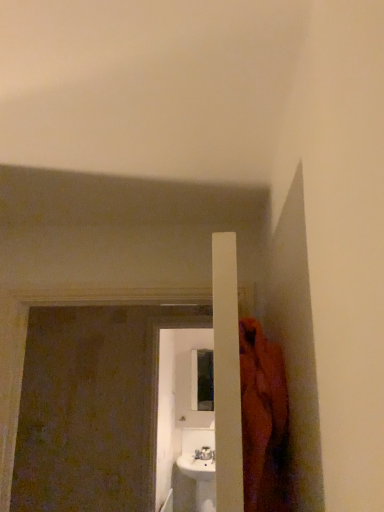
Question: Considering the relative positions of white glossy screen door at center, positioned as the first screen door in back-to-front order, and brown textured screen door at left, the first screen door when ordered from front to back, in the image provided, is white glossy screen door at center, positioned as the first screen door in back-to-front order, to the right of brown textured screen door at left, the first screen door when ordered from front to back, from the viewer's perspective?

Choices:
 (A) no
 (B) yes

Answer: (B)

Question: Does white glossy screen door at center, placed as the 2th screen door when sorted from front to back, have a lesser height compared to brown textured screen door at left, the first screen door when ordered from front to back?

Choices:
 (A) yes
 (B) no

Answer: (B)

Question: Are white glossy screen door at center, positioned as the first screen door in back-to-front order, and brown textured screen door at left, the 2th screen door from the back, beside each other?

Choices:
 (A) yes
 (B) no

Answer: (B)

Question: From the image's perspective, would you say white glossy screen door at center, placed as the 2th screen door when sorted from front to back, is shown under brown textured screen door at left, the 2th screen door from the back?

Choices:
 (A) yes
 (B) no

Answer: (A)

Question: From a real-world perspective, is white glossy screen door at center, positioned as the first screen door in back-to-front order, on brown textured screen door at left, the 2th screen door from the back?

Choices:
 (A) yes
 (B) no

Answer: (B)

Question: Can you confirm if white glossy screen door at center, positioned as the first screen door in back-to-front order, is wider than brown textured screen door at left, the first screen door when ordered from front to back?

Choices:
 (A) yes
 (B) no

Answer: (B)

Question: From the image's perspective, is brown textured screen door at left, the 2th screen door from the back, on white glossy screen door at center, placed as the 2th screen door when sorted from front to back?

Choices:
 (A) yes
 (B) no

Answer: (A)

Question: From the image's perspective, is brown textured screen door at left, the first screen door when ordered from front to back, below white glossy screen door at center, positioned as the first screen door in back-to-front order?

Choices:
 (A) no
 (B) yes

Answer: (A)

Question: Could you tell me if brown textured screen door at left, the first screen door when ordered from front to back, is turned towards white glossy screen door at center, placed as the 2th screen door when sorted from front to back?

Choices:
 (A) no
 (B) yes

Answer: (A)

Question: Does brown textured screen door at left, the first screen door when ordered from front to back, appear on the left side of white glossy screen door at center, positioned as the first screen door in back-to-front order?

Choices:
 (A) yes
 (B) no

Answer: (A)

Question: Does brown textured screen door at left, the 2th screen door from the back, have a smaller size compared to white glossy screen door at center, positioned as the first screen door in back-to-front order?

Choices:
 (A) no
 (B) yes

Answer: (A)

Question: Is the position of brown textured screen door at left, the first screen door when ordered from front to back, less distant than that of white glossy screen door at center, positioned as the first screen door in back-to-front order?

Choices:
 (A) no
 (B) yes

Answer: (B)

Question: In the image, is white glossy screen door at center, placed as the 2th screen door when sorted from front to back, positioned in front of or behind brown textured screen door at left, the first screen door when ordered from front to back?

Choices:
 (A) behind
 (B) front

Answer: (A)